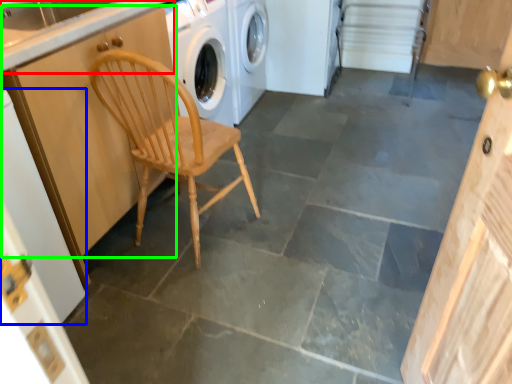
Question: Estimate the real-world distances between objects in this image. Which object is farther from counter top (highlighted by a red box), door (highlighted by a blue box) or cabinetry (highlighted by a green box)?

Choices:
 (A) door
 (B) cabinetry

Answer: (A)